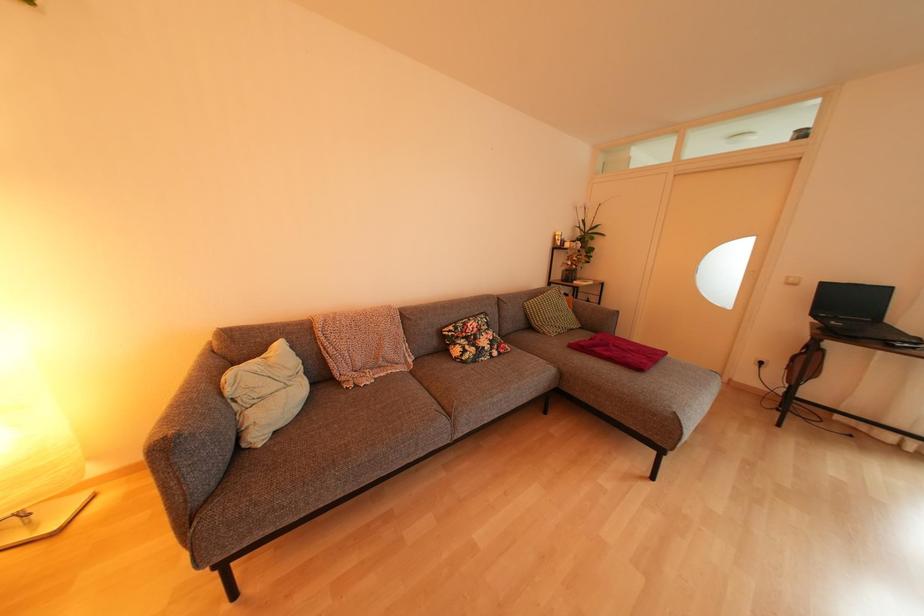
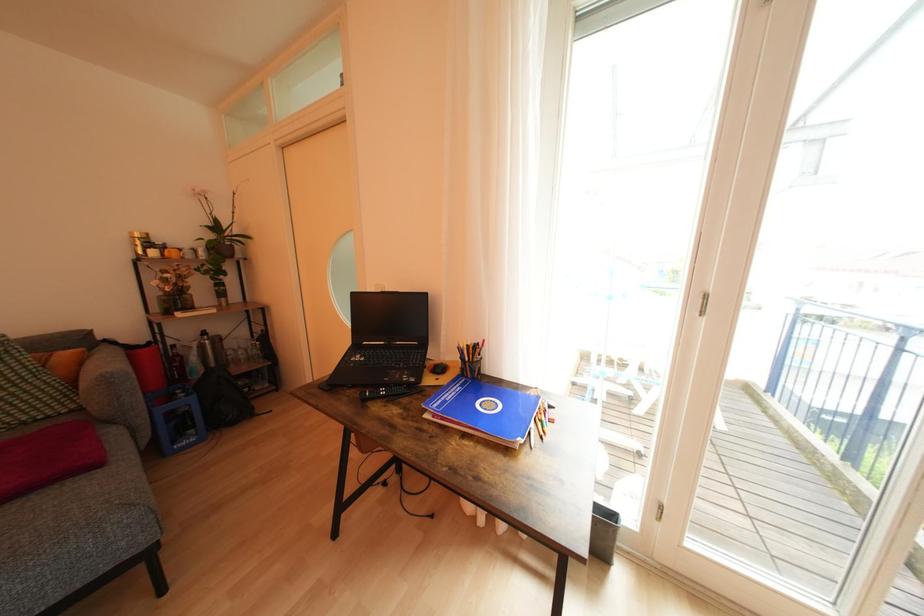
Question: What movement of the cameraman would produce the second image?

Choices:
 (A) Left
 (B) Right
 (C) Forward
 (D) Backward

Answer: (B)